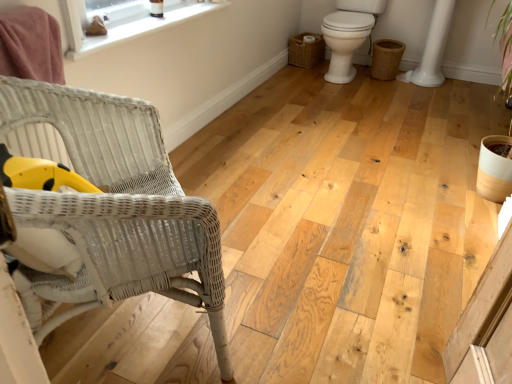
Locate an element on the screen. vacant point to the right of braided wicker basket at lower right, positioned as the 1th basket in right-to-left order is located at coordinates (413, 85).